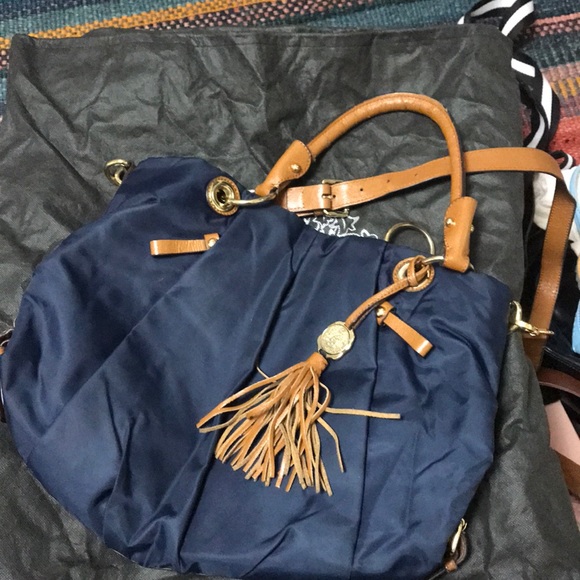
I want to click on handle, so 405,101.